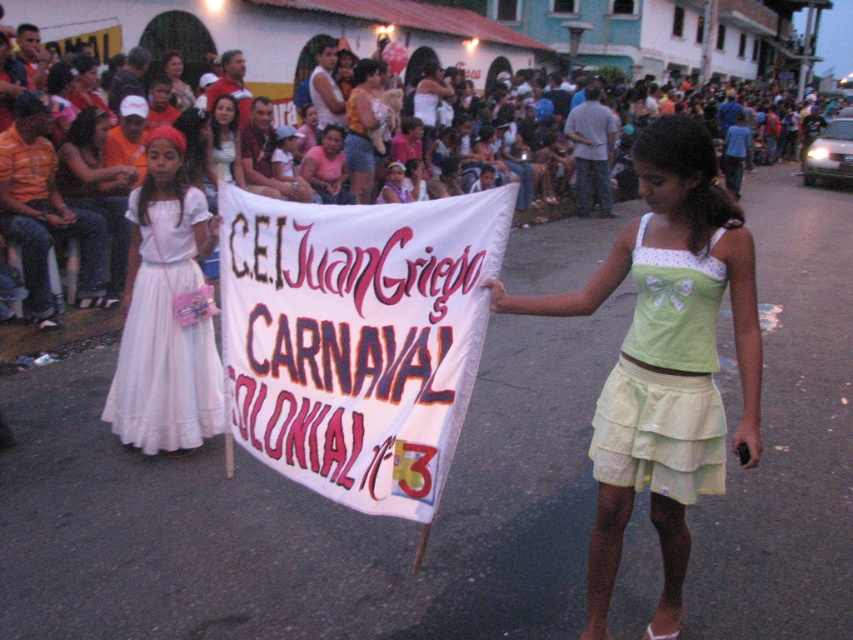
Question: Where is white cotton clothing at upper center located in relation to white satin dress at left in the image?

Choices:
 (A) below
 (B) above

Answer: (B)

Question: Which object appears farthest from the camera in this image?

Choices:
 (A) white satin dress at left
 (B) green polka dot fabric at center

Answer: (A)

Question: Is white paper banner at center positioned before white cotton clothing at upper center?

Choices:
 (A) yes
 (B) no

Answer: (A)

Question: Is white paper banner at center positioned in front of light green cotton skirt at center?

Choices:
 (A) no
 (B) yes

Answer: (B)

Question: Which object is closer to the camera taking this photo?

Choices:
 (A) white satin dress at left
 (B) light green cotton skirt at center

Answer: (B)

Question: Which point appears closest to the camera in this image?

Choices:
 (A) (461, 24)
 (B) (616, 515)

Answer: (B)